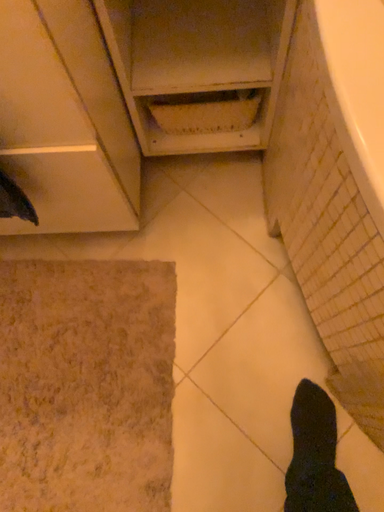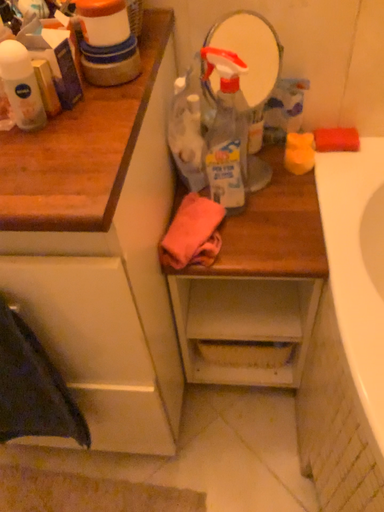
Question: How did the camera likely rotate when shooting the video?

Choices:
 (A) rotated upward
 (B) rotated downward

Answer: (A)